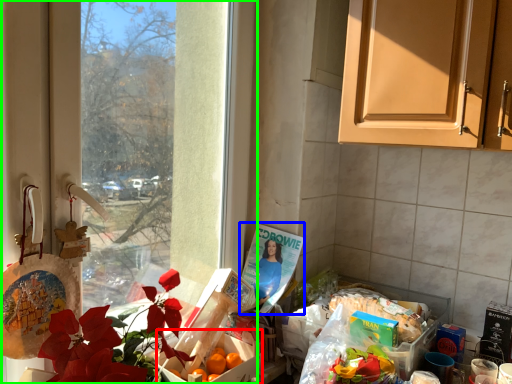
Question: Which object is positioned farthest from box (highlighted by a red box)? Select from magazine (highlighted by a blue box) and window (highlighted by a green box).

Choices:
 (A) magazine
 (B) window

Answer: (B)